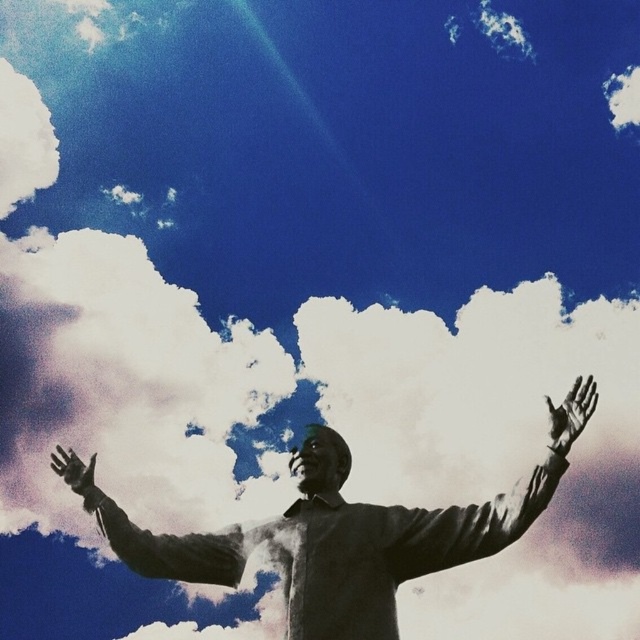
You are an architect designing a new public space and want to place a new bench in the image. The bench must be placed such that it is directly to the right of the bronze statue at center. Given that the statue is located at coordinates 0.850 on the x and 0.527 on the y, what would be the x coordinate of the bench if it is placed 0.1 units to the right of the statue?

The bronze statue at center is located at x coordinate 0.850. Placing the bench 0.1 units to the right would result in an x coordinate of 0.950.

You are an art curator planning to install a new light fixture in the gallery. The light must illuminate both the bronze statue at center and the black matte hand at lower left without casting shadows over the artworks. Given their positions, where should you place the light source?

The bronze statue at center is located below the black matte hand at lower left. To avoid casting shadows over both artworks, the light source should be placed above and between them, ensuring even illumination while minimizing shadow interference.

You are an artist analyzing the statue in the image. You notice the smooth black arm at center and the smooth skin hand at upper right. Based on their positions, which object is closer to the left side of the statue?

The smooth black arm at center is closer to the left side of the statue because it is positioned to the left of the smooth skin hand at upper right.